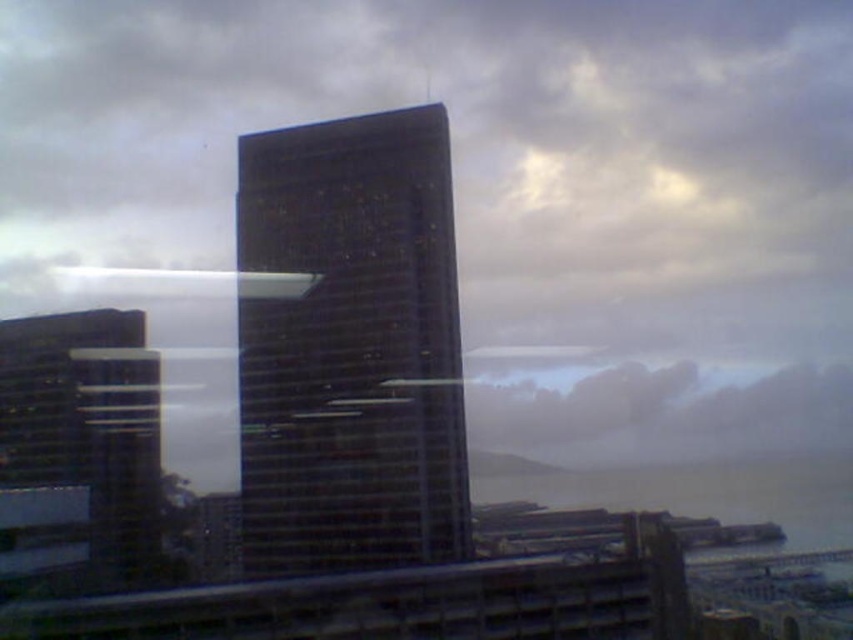
Question: Based on their relative distances, which object is nearer to the glassy reflective skyscraper at left?

Choices:
 (A) gray water at lower right
 (B) dark glass skyscraper at center

Answer: (B)

Question: Does glassy reflective skyscraper at left appear on the left side of gray water at lower right?

Choices:
 (A) yes
 (B) no

Answer: (A)

Question: Which is farther from the dark glass skyscraper at center?

Choices:
 (A) glassy reflective skyscraper at left
 (B) gray water at lower right

Answer: (B)

Question: Which point is farther to the camera?

Choices:
 (A) tap(317, 445)
 (B) tap(804, 528)
 (C) tap(160, 484)

Answer: (B)

Question: Can you confirm if glassy reflective skyscraper at left is bigger than gray water at lower right?

Choices:
 (A) no
 (B) yes

Answer: (A)

Question: Is dark glass skyscraper at center smaller than gray water at lower right?

Choices:
 (A) yes
 (B) no

Answer: (A)